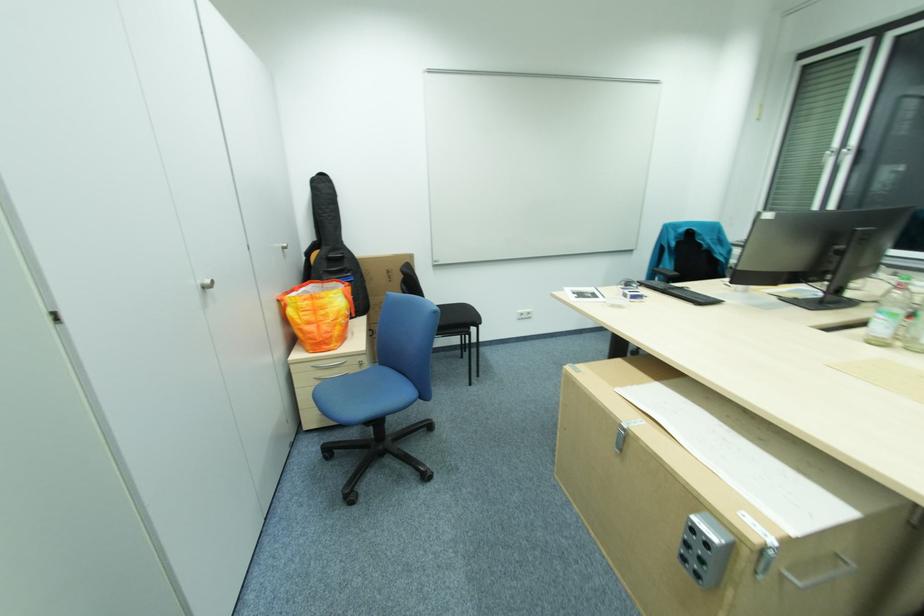
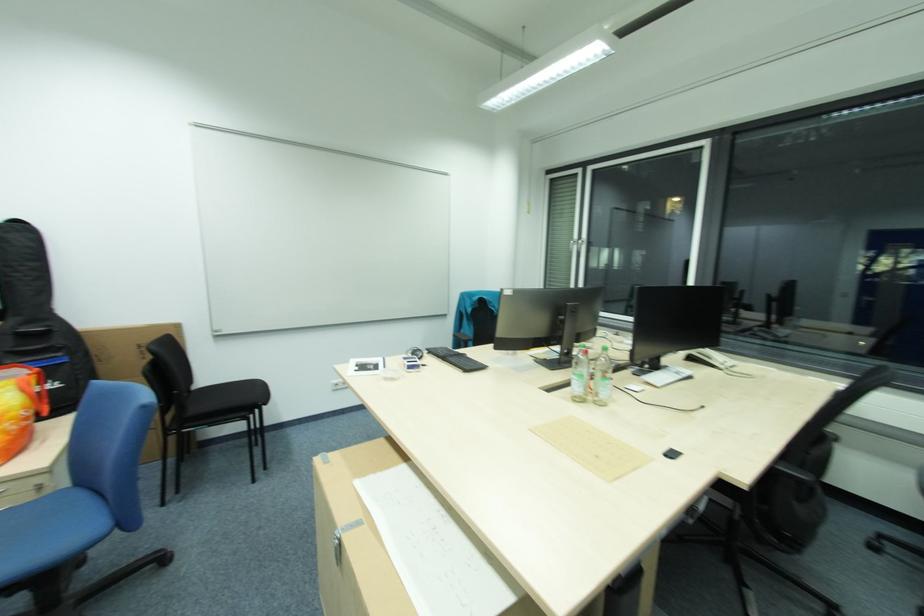
Locate, in the second image, the point that corresponds to [891,320] in the first image.

(588, 379)